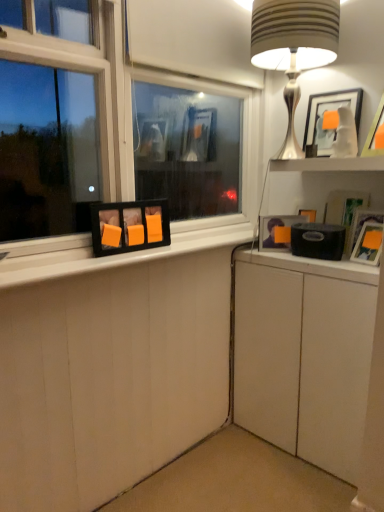
Question: From a real-world perspective, is matte black frame at left above or below matte white picture frame at upper right, the third picture frame from the left?

Choices:
 (A) above
 (B) below

Answer: (B)

Question: Is matte black frame at left bigger or smaller than matte white picture frame at upper right, acting as the 2th picture frame starting from the right?

Choices:
 (A) big
 (B) small

Answer: (A)

Question: Which object is positioned farthest from the matte black frame at left?

Choices:
 (A) matte black picture frame at right, positioned as the 3th picture frame in right-to-left order
 (B) matte white picture frame at upper right, acting as the 2th picture frame starting from the right
 (C) white matte cabinet at lower right
 (D) white glossy shelf at upper right
 (E) matte black picture frame at right, which is the first picture frame in right-to-left order

Answer: (E)

Question: Estimate the real-world distances between objects in this image. Which object is farther from the matte black picture frame at right, which is the first picture frame in right-to-left order?

Choices:
 (A) matte black picture frame at right, positioned as the 3th picture frame in right-to-left order
 (B) satin silver table lamp at upper right
 (C) matte black frame at left
 (D) white matte cabinet at lower right
 (E) matte white picture frame at upper right, acting as the 2th picture frame starting from the right

Answer: (C)